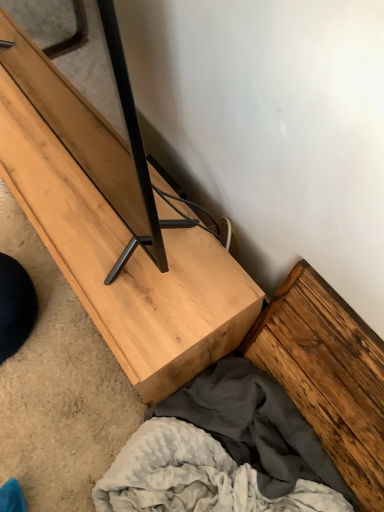
The width and height of the screenshot is (384, 512). What do you see at coordinates (93, 132) in the screenshot?
I see `black matte wood plank at center, placed as the second plank when sorted from bottom to top` at bounding box center [93, 132].

Image resolution: width=384 pixels, height=512 pixels. I want to click on natural wood tv stand at center, so click(x=115, y=228).

Between natural wood tv stand at center and wooden plank at lower right, acting as the second plank starting from the left, which one has smaller size?

wooden plank at lower right, acting as the second plank starting from the left, is smaller.

Which is more to the right, natural wood tv stand at center or wooden plank at lower right, arranged as the first plank when viewed from the right?

wooden plank at lower right, arranged as the first plank when viewed from the right.

From their relative heights in the image, would you say natural wood tv stand at center is taller or shorter than wooden plank at lower right, acting as the 2th plank starting from the top?

In the image, natural wood tv stand at center appears to be shorter than wooden plank at lower right, acting as the 2th plank starting from the top.

Is natural wood tv stand at center not within wooden plank at lower right, arranged as the first plank when viewed from the right?

natural wood tv stand at center is positioned outside wooden plank at lower right, arranged as the first plank when viewed from the right.

Is there a large distance between wooden plank at lower right, acting as the second plank starting from the left, and black matte wood plank at center, arranged as the first plank when viewed from the left?

No, there isn't a large distance between wooden plank at lower right, acting as the second plank starting from the left, and black matte wood plank at center, arranged as the first plank when viewed from the left.

Is wooden plank at lower right, acting as the second plank starting from the left, wider than black matte wood plank at center, placed as the second plank when sorted from bottom to top?

In fact, wooden plank at lower right, acting as the second plank starting from the left, might be narrower than black matte wood plank at center, placed as the second plank when sorted from bottom to top.

Is wooden plank at lower right, acting as the 2th plank starting from the top, taller or shorter than black matte wood plank at center, the 2th plank positioned from the right?

wooden plank at lower right, acting as the 2th plank starting from the top, is shorter than black matte wood plank at center, the 2th plank positioned from the right.

Does black matte wood plank at center, arranged as the first plank when viewed from the left, turn towards natural wood tv stand at center?

No, black matte wood plank at center, arranged as the first plank when viewed from the left, does not turn towards natural wood tv stand at center.

Would you say black matte wood plank at center, arranged as the first plank when viewed from the left, is outside natural wood tv stand at center?

Yes, black matte wood plank at center, arranged as the first plank when viewed from the left, is located beyond the bounds of natural wood tv stand at center.

Which is in front, black matte wood plank at center, the 2th plank positioned from the right, or natural wood tv stand at center?

black matte wood plank at center, the 2th plank positioned from the right.

Is natural wood tv stand at center oriented away from black matte wood plank at center, the 2th plank positioned from the right?

No, natural wood tv stand at center is not facing the opposite direction of black matte wood plank at center, the 2th plank positioned from the right.

Is natural wood tv stand at center located outside black matte wood plank at center, placed as the second plank when sorted from bottom to top?

Yes, natural wood tv stand at center is not within black matte wood plank at center, placed as the second plank when sorted from bottom to top.

From a real-world perspective, is natural wood tv stand at center positioned above or below black matte wood plank at center, the 2th plank positioned from the right?

natural wood tv stand at center is below black matte wood plank at center, the 2th plank positioned from the right.

Who is more distant, natural wood tv stand at center or black matte wood plank at center, the 2th plank positioned from the right?

natural wood tv stand at center is further away from the camera.

From a real-world perspective, which is physically above, wooden plank at lower right, arranged as the 1th plank when ordered from the bottom, or natural wood tv stand at center?

In real-world perspective, wooden plank at lower right, arranged as the 1th plank when ordered from the bottom, is above.

Is wooden plank at lower right, arranged as the first plank when viewed from the right, shorter than natural wood tv stand at center?

Incorrect, the height of wooden plank at lower right, arranged as the first plank when viewed from the right, does not fall short of that of natural wood tv stand at center.

From the image's perspective, is wooden plank at lower right, arranged as the first plank when viewed from the right, beneath natural wood tv stand at center?

Indeed, from the image's perspective, wooden plank at lower right, arranged as the first plank when viewed from the right, is shown beneath natural wood tv stand at center.

Is wooden plank at lower right, acting as the 2th plank starting from the top, smaller than natural wood tv stand at center?

Yes.

From the image's perspective, between black matte wood plank at center, arranged as the first plank when viewed from the left, and wooden plank at lower right, arranged as the first plank when viewed from the right, which one is located above?

From the image's view, black matte wood plank at center, arranged as the first plank when viewed from the left, is above.

Is black matte wood plank at center, arranged as the first plank when viewed from the left, oriented towards wooden plank at lower right, acting as the 2th plank starting from the top?

No, black matte wood plank at center, arranged as the first plank when viewed from the left, is not facing towards wooden plank at lower right, acting as the 2th plank starting from the top.

Which object is thinner, black matte wood plank at center, the 1th plank positioned from the top, or wooden plank at lower right, acting as the 2th plank starting from the top?

wooden plank at lower right, acting as the 2th plank starting from the top.

Which object is closer to the camera, black matte wood plank at center, arranged as the first plank when viewed from the left, or wooden plank at lower right, acting as the second plank starting from the left?

black matte wood plank at center, arranged as the first plank when viewed from the left, is closer to the camera.

In the image, there is a wooden plank at lower right, arranged as the first plank when viewed from the right. Where is `furniture above it (from the image's perspective)`? furniture above it (from the image's perspective) is located at coordinates (115, 228).

I want to click on plank on the right of black matte wood plank at center, placed as the second plank when sorted from bottom to top, so click(328, 374).

Based on their spatial positions, is natural wood tv stand at center or black matte wood plank at center, placed as the second plank when sorted from bottom to top, further from wooden plank at lower right, arranged as the 1th plank when ordered from the bottom?

black matte wood plank at center, placed as the second plank when sorted from bottom to top, lies further to wooden plank at lower right, arranged as the 1th plank when ordered from the bottom, than the other object.

From the image, which object appears to be nearer to natural wood tv stand at center, wooden plank at lower right, arranged as the first plank when viewed from the right, or black matte wood plank at center, arranged as the first plank when viewed from the left?

black matte wood plank at center, arranged as the first plank when viewed from the left.

Which object lies further to the anchor point black matte wood plank at center, the 2th plank positioned from the right, wooden plank at lower right, arranged as the first plank when viewed from the right, or natural wood tv stand at center?

wooden plank at lower right, arranged as the first plank when viewed from the right, is further to black matte wood plank at center, the 2th plank positioned from the right.

From the picture: Estimate the real-world distances between objects in this image. Which object is further from natural wood tv stand at center, black matte wood plank at center, arranged as the first plank when viewed from the left, or wooden plank at lower right, acting as the 2th plank starting from the top?

Based on the image, wooden plank at lower right, acting as the 2th plank starting from the top, appears to be further to natural wood tv stand at center.

Considering their positions, is black matte wood plank at center, the 2th plank positioned from the right, positioned further to wooden plank at lower right, arranged as the first plank when viewed from the right, than natural wood tv stand at center?

Among the two, black matte wood plank at center, the 2th plank positioned from the right, is located further to wooden plank at lower right, arranged as the first plank when viewed from the right.

Looking at the image, which one is located closer to black matte wood plank at center, placed as the second plank when sorted from bottom to top, natural wood tv stand at center or wooden plank at lower right, arranged as the 1th plank when ordered from the bottom?

The object closer to black matte wood plank at center, placed as the second plank when sorted from bottom to top, is natural wood tv stand at center.

Locate an element on the screen. furniture between black matte wood plank at center, the 2th plank positioned from the right, and wooden plank at lower right, arranged as the 1th plank when ordered from the bottom, from top to bottom is located at coordinates (115, 228).